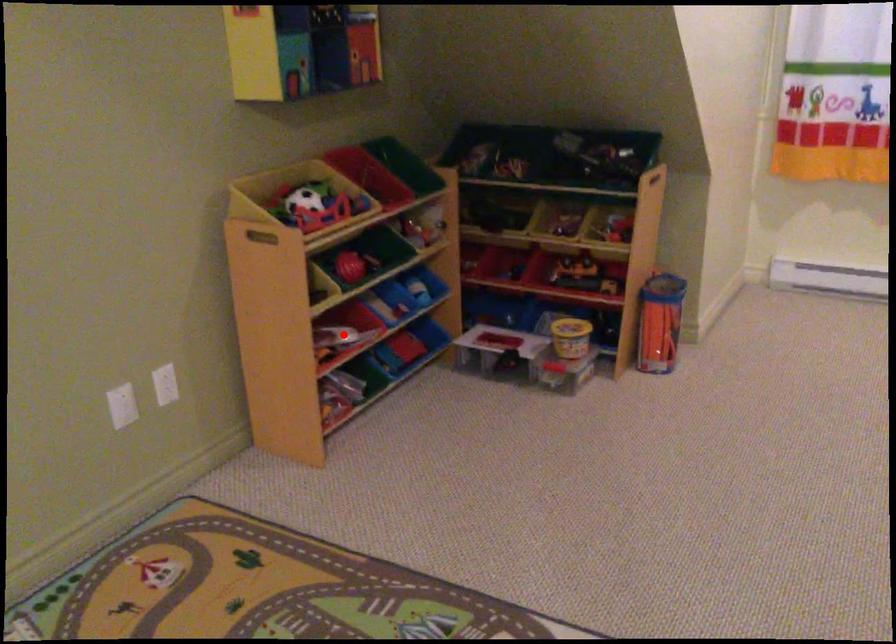
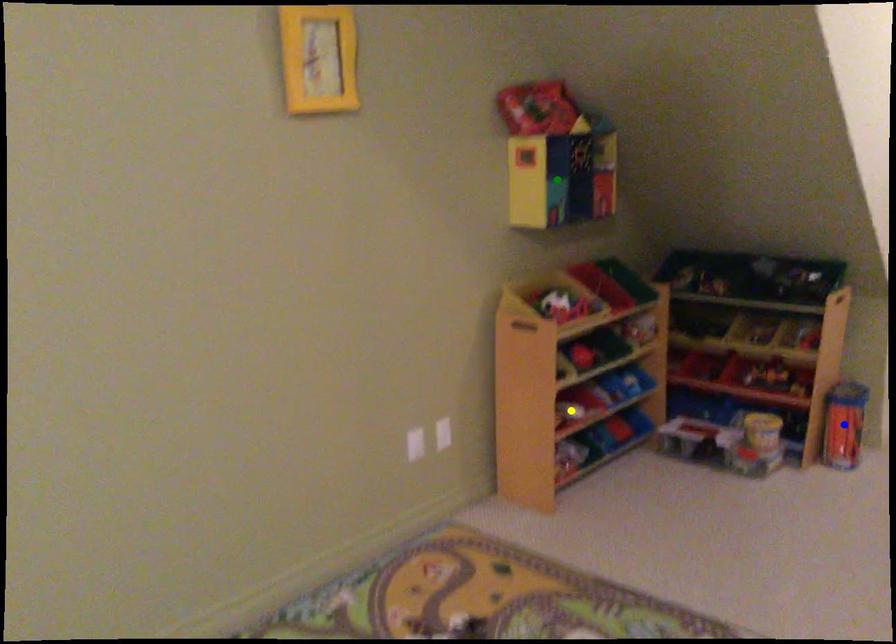
Question: I am providing you with two images of the same scene from different viewpoints. A red point is marked on the first image. You are given multiple points on the second image. In image 2, which mark is for the same physical point as the one in image 1?

Choices:
 (A) green point
 (B) yellow point
 (C) blue point

Answer: (B)